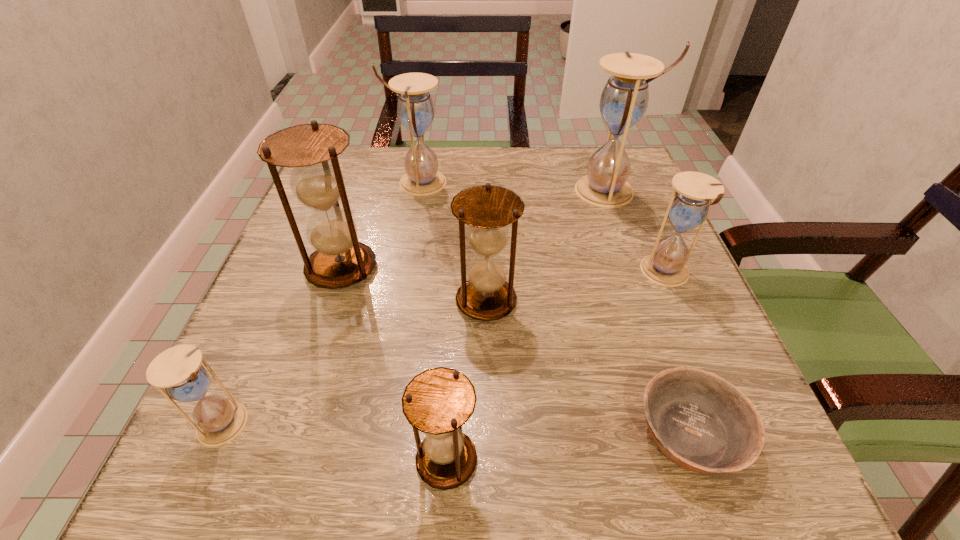
Where is `white hourglass that stands as the second closest to the biggest brown hourglass`? The height and width of the screenshot is (540, 960). white hourglass that stands as the second closest to the biggest brown hourglass is located at coordinates (178, 369).

Identify which brown hourglass is the third nearest to the tallest hourglass. Please provide its 2D coordinates. Your answer should be formatted as a tuple, i.e. [(x, y)], where the tuple contains the x and y coordinates of a point satisfying the conditions above.

[(439, 401)]

Image resolution: width=960 pixels, height=540 pixels. In order to click on brown hourglass object that ranks as the second closest to the third biggest white hourglass in this screenshot , I will do `click(439, 401)`.

Find the location of a particular element. vacant space that satisfies the following two spatial constraints: 1. on the front side of the third white hourglass from right to left; 2. on the right side of the second smallest brown hourglass is located at coordinates (397, 301).

Image resolution: width=960 pixels, height=540 pixels. I want to click on vacant space that satisfies the following two spatial constraints: 1. on the back side of the second nearest white hourglass; 2. on the left side of the second biggest brown hourglass, so click(486, 273).

The image size is (960, 540). Identify the location of vacant space that satisfies the following two spatial constraints: 1. on the back side of the second biggest white hourglass; 2. on the right side of the leftmost white hourglass. (329, 183).